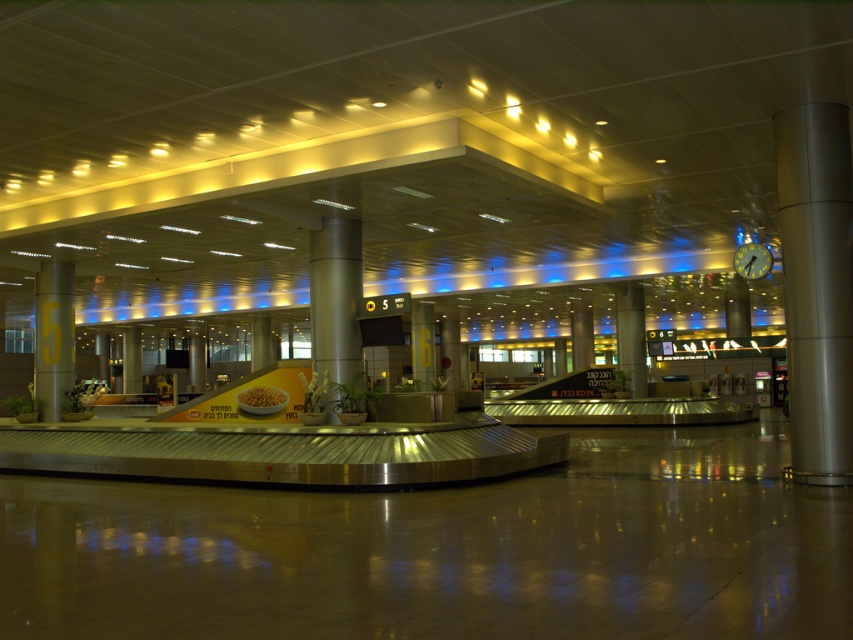
Question: Which object is the closest to the silver metallic pillar at center?

Choices:
 (A) yellow metallic pillar at left
 (B) metallic column at right

Answer: (A)

Question: Does silver metallic pillar at center have a smaller size compared to satin silver column at center?

Choices:
 (A) no
 (B) yes

Answer: (B)

Question: Which point is closer to the camera taking this photo?

Choices:
 (A) (618, 333)
 (B) (56, 292)
 (C) (786, 147)

Answer: (C)

Question: Which point is closer to the camera?

Choices:
 (A) (625, 371)
 (B) (759, 273)
 (C) (57, 413)
 (D) (352, 262)

Answer: (B)

Question: Can you confirm if metallic column at right is positioned above green glass clock at upper right?

Choices:
 (A) yes
 (B) no

Answer: (B)

Question: Can you confirm if metallic column at right is positioned below yellow metallic pillar at left?

Choices:
 (A) yes
 (B) no

Answer: (B)